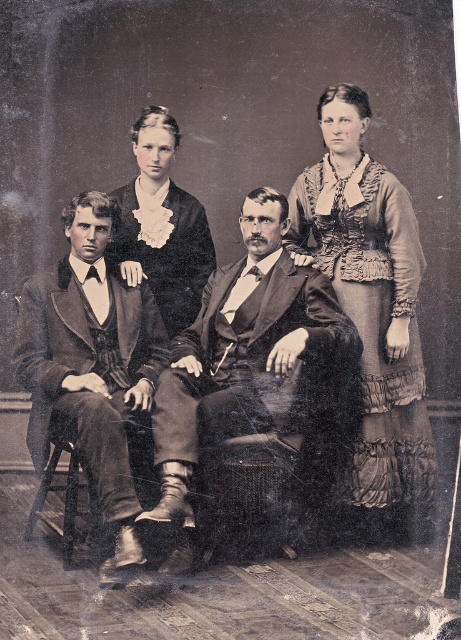
Identify the location of matte black suit at center. This screenshot has width=461, height=640. [x=360, y=292].

Between matte black suit at center and matte brown suit at left, which one has more height?

With more height is matte black suit at center.

The width and height of the screenshot is (461, 640). Describe the element at coordinates (360, 292) in the screenshot. I see `matte black suit at center` at that location.

Where is `matte black suit at center`? The height and width of the screenshot is (640, 461). matte black suit at center is located at coordinates (360, 292).

Is matte brown suit at left taller than matte black dress at center?

Yes.

Who is lower down, matte brown suit at left or matte black dress at center?

matte brown suit at left is below.

What do you see at coordinates (90, 368) in the screenshot? I see `matte brown suit at left` at bounding box center [90, 368].

Identify the location of matte brown suit at left. (90, 368).

Does matte brown suit at left have a greater width compared to ruffled fabric dress at right?

In fact, matte brown suit at left might be narrower than ruffled fabric dress at right.

Is point (135, 342) farther from camera compared to point (418, 381)?

That is False.

Locate an element on the screen. This screenshot has height=640, width=461. matte brown suit at left is located at coordinates (90, 368).

You are a GUI agent. You are given a task and a screenshot of the screen. Output one action in this format:
    pyautogui.click(x=<x>, y=<y>)
    Task: Click on the matte brown suit at left
    Image resolution: width=461 pixels, height=640 pixels.
    Given the screenshot: What is the action you would take?
    pyautogui.click(x=90, y=368)